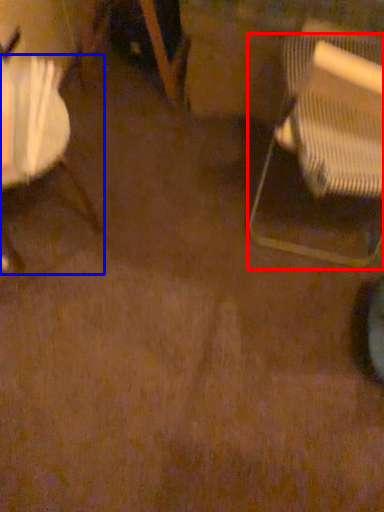
Question: Among these objects, which one is farthest to the camera, chair (highlighted by a red box) or chair (highlighted by a blue box)?

Choices:
 (A) chair
 (B) chair

Answer: (B)